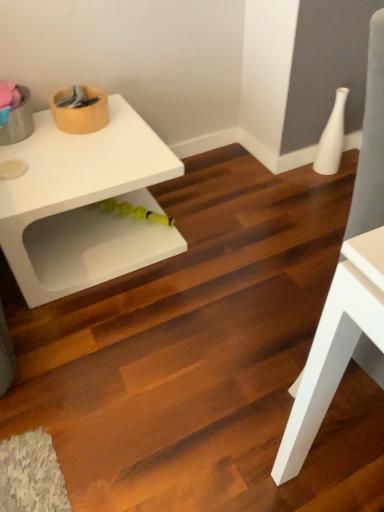
Image resolution: width=384 pixels, height=512 pixels. Identify the location of free location in front of white matte table at upper left, which is the second table from right to left. (114, 345).